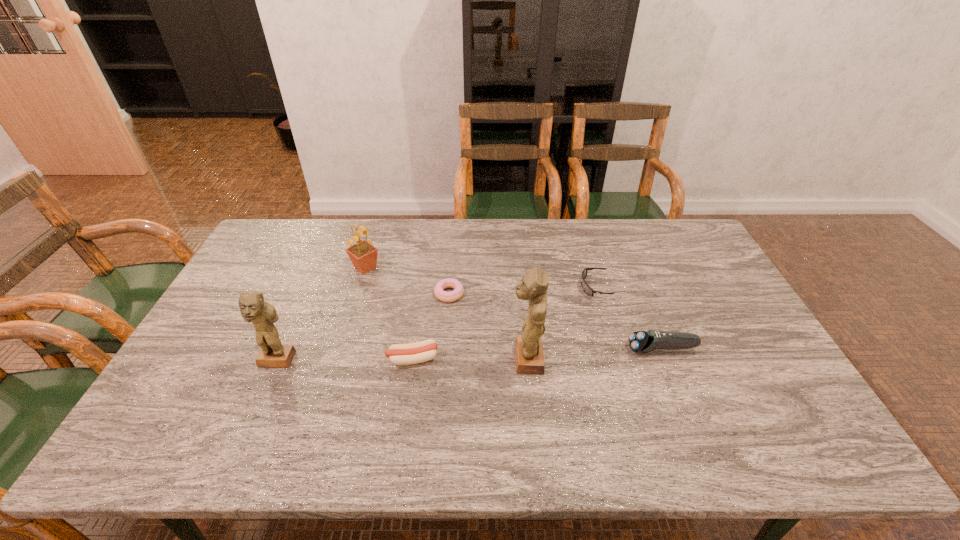
The image size is (960, 540). What are the coordinates of `vacant space situated on the front-facing side of the shorter figurine` in the screenshot? It's located at (261, 398).

Where is `free location located 0.360m on the front-facing side of the fifth object from left to right`? The width and height of the screenshot is (960, 540). free location located 0.360m on the front-facing side of the fifth object from left to right is located at coordinates pyautogui.click(x=376, y=359).

The image size is (960, 540). What are the coordinates of `vacant space positioned on the front-facing side of the fifth object from left to right` in the screenshot? It's located at (432, 359).

Where is `vacant space located on the front-facing side of the fifth object from left to right`? The image size is (960, 540). vacant space located on the front-facing side of the fifth object from left to right is located at coordinates (455, 359).

Identify the location of free location located 0.380m at the front of the sunflower with flowers visible. The height and width of the screenshot is (540, 960). (495, 268).

Where is `vacant area situated on the lenses of the goggles`? vacant area situated on the lenses of the goggles is located at coordinates (558, 287).

You are a GUI agent. You are given a task and a screenshot of the screen. Output one action in this format:
    pyautogui.click(x=<x>, y=<y>)
    Task: Click on the free space located on the lenses of the goggles
    The image size is (960, 540).
    Given the screenshot: What is the action you would take?
    pyautogui.click(x=457, y=287)

You are a GUI agent. You are given a task and a screenshot of the screen. Output one action in this format:
    pyautogui.click(x=<x>, y=<y>)
    Task: Click on the free space located on the lenses of the goggles
    The image size is (960, 540).
    Given the screenshot: What is the action you would take?
    (x=548, y=287)

At what (x,y) coordinates should I click in order to perform the action: click on free space located on the front of the shortest object. Please return your answer as a coordinate pair (x, y). Image resolution: width=960 pixels, height=540 pixels. Looking at the image, I should click on (444, 362).

What are the coordinates of `vacant area situated 0.150m on the head of the fourth shortest object` in the screenshot? It's located at (573, 349).